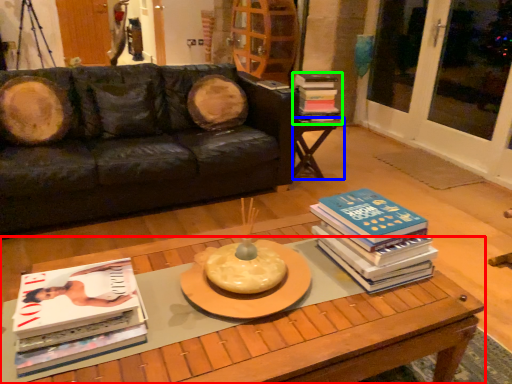
Question: Considering the real-world distances, which object is farthest from coffee table (highlighted by a red box)? table (highlighted by a blue box) or book (highlighted by a green box)?

Choices:
 (A) table
 (B) book

Answer: (B)